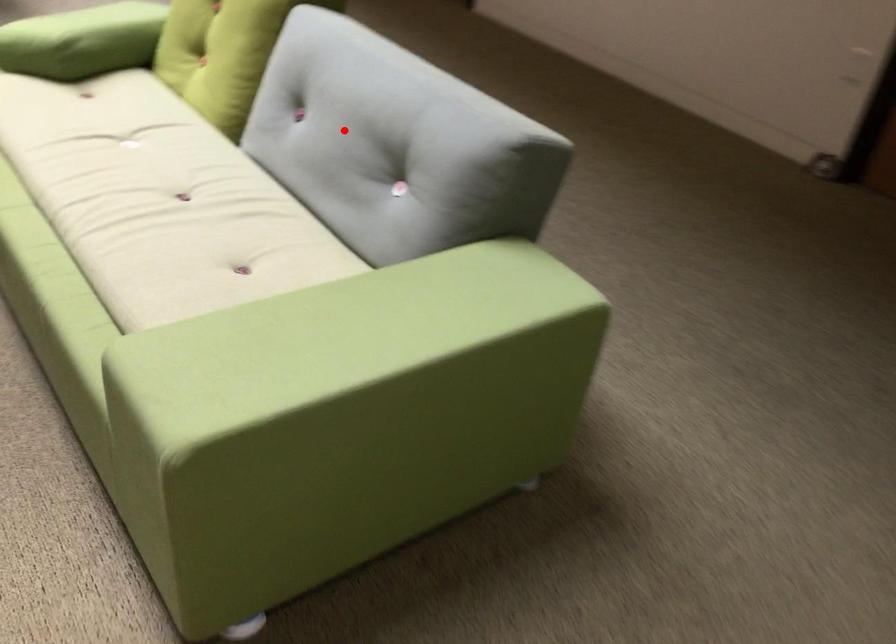
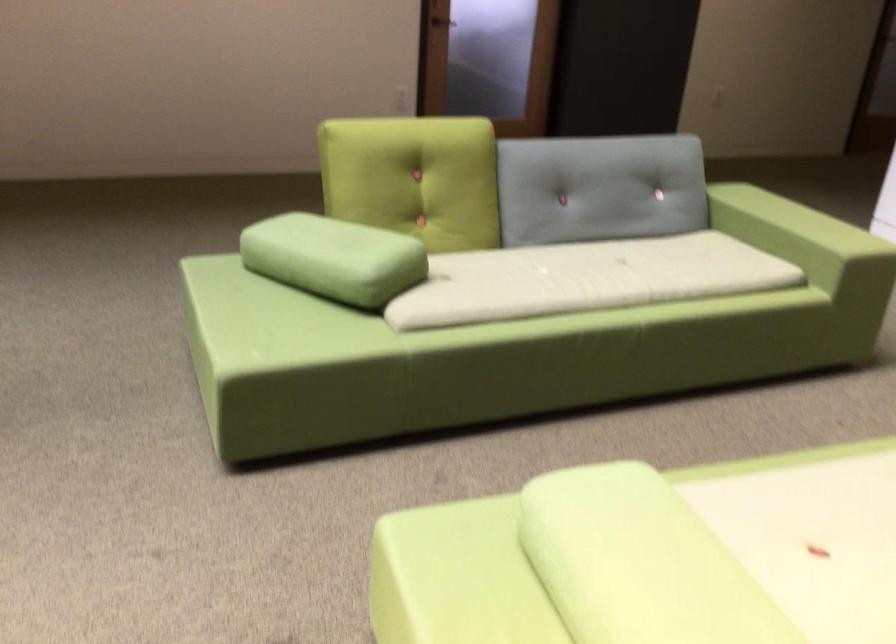
Locate, in the second image, the point that corresponds to the highlighted location in the first image.

(599, 187)